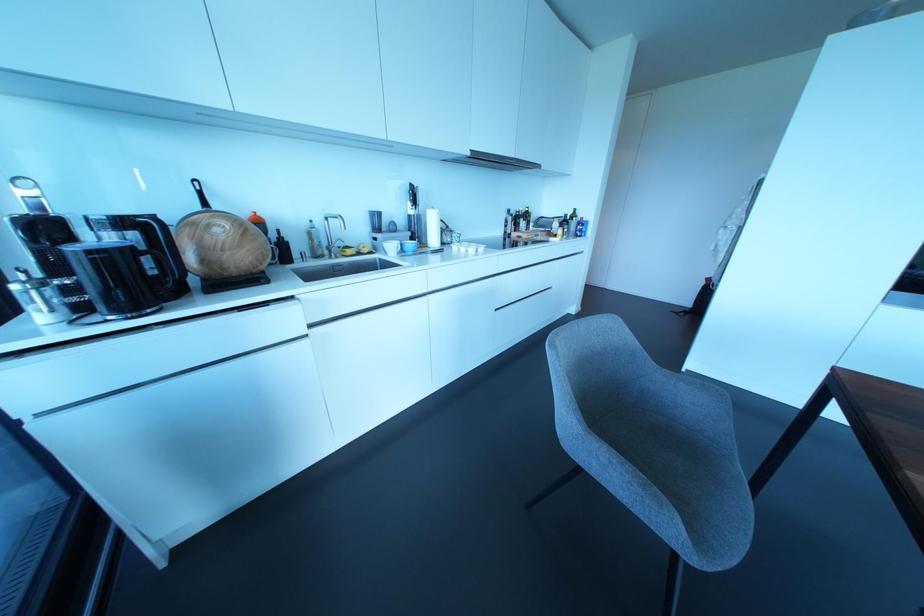
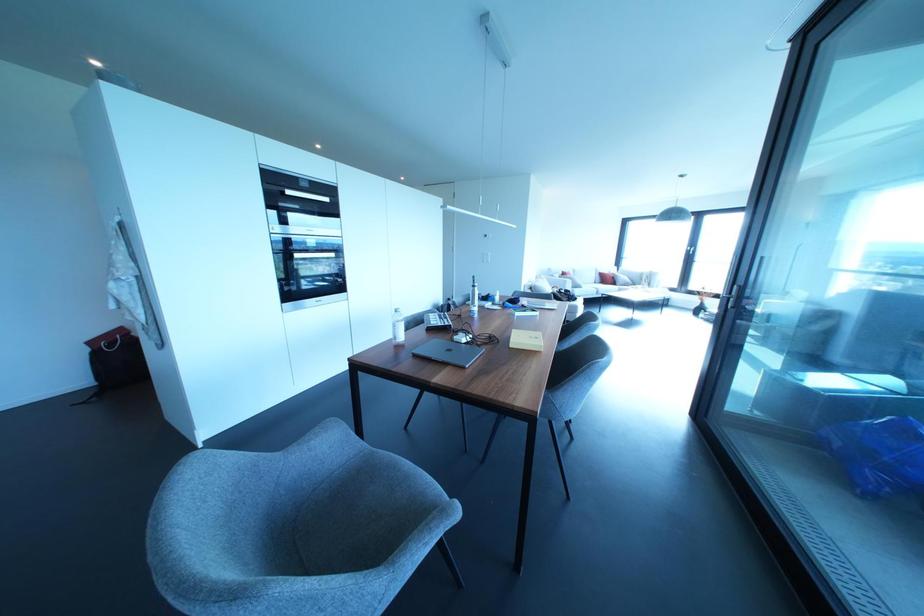
How did the camera likely rotate?

The camera's rotation is toward right-down.